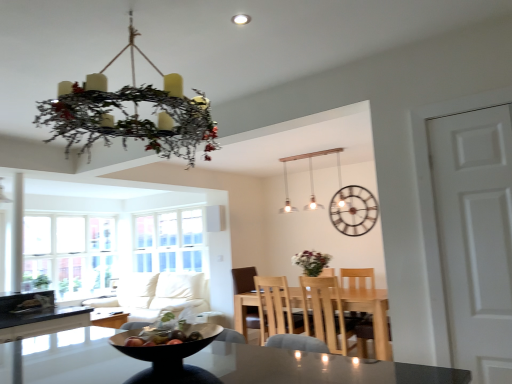
Question: Can you confirm if matte wooden table at center is positioned to the right of shiny plastic bowl at center?

Choices:
 (A) no
 (B) yes

Answer: (B)

Question: Is matte wooden table at center positioned behind shiny plastic bowl at center?

Choices:
 (A) yes
 (B) no

Answer: (A)

Question: From a real-world perspective, is matte wooden table at center located beneath shiny plastic bowl at center?

Choices:
 (A) yes
 (B) no

Answer: (A)

Question: Is matte wooden table at center positioned with its back to shiny plastic bowl at center?

Choices:
 (A) no
 (B) yes

Answer: (A)

Question: Considering the relative sizes of matte wooden table at center and shiny plastic bowl at center in the image provided, is matte wooden table at center smaller than shiny plastic bowl at center?

Choices:
 (A) no
 (B) yes

Answer: (A)

Question: Visually, is matte white pendant lights at upper center positioned to the left or to the right of shiny plastic bowl at center?

Choices:
 (A) right
 (B) left

Answer: (A)

Question: In the image, is matte white pendant lights at upper center positioned in front of or behind shiny plastic bowl at center?

Choices:
 (A) front
 (B) behind

Answer: (B)

Question: Considering the positions of matte white pendant lights at upper center and shiny plastic bowl at center in the image, is matte white pendant lights at upper center wider or thinner than shiny plastic bowl at center?

Choices:
 (A) thin
 (B) wide

Answer: (A)

Question: From the image's perspective, is matte white pendant lights at upper center positioned above or below shiny plastic bowl at center?

Choices:
 (A) below
 (B) above

Answer: (B)

Question: Relative to metallic clock at upper center, is white fabric couch at lower left in front or behind?

Choices:
 (A) front
 (B) behind

Answer: (B)

Question: Visually, is white fabric couch at lower left positioned to the left or to the right of metallic clock at upper center?

Choices:
 (A) right
 (B) left

Answer: (B)

Question: From a real-world perspective, relative to metallic clock at upper center, is white fabric couch at lower left vertically above or below?

Choices:
 (A) below
 (B) above

Answer: (A)

Question: Is white fabric couch at lower left bigger or smaller than metallic clock at upper center?

Choices:
 (A) small
 (B) big

Answer: (B)

Question: In the image, is light wood table at center positioned in front of or behind metallic clock at upper center?

Choices:
 (A) behind
 (B) front

Answer: (B)

Question: From a real-world perspective, is light wood table at center above or below metallic clock at upper center?

Choices:
 (A) below
 (B) above

Answer: (A)